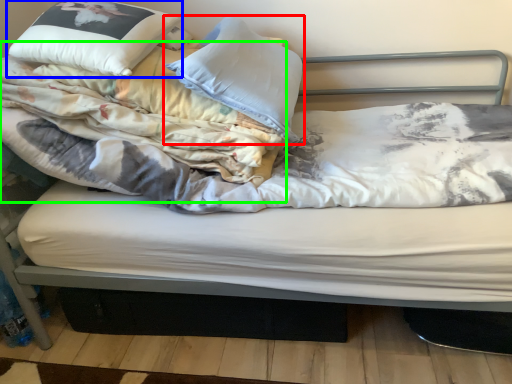
Question: Based on their relative distances, which object is farther from pillow (highlighted by a red box)? Choose from pillow (highlighted by a blue box) and blanket (highlighted by a green box).

Choices:
 (A) pillow
 (B) blanket

Answer: (A)